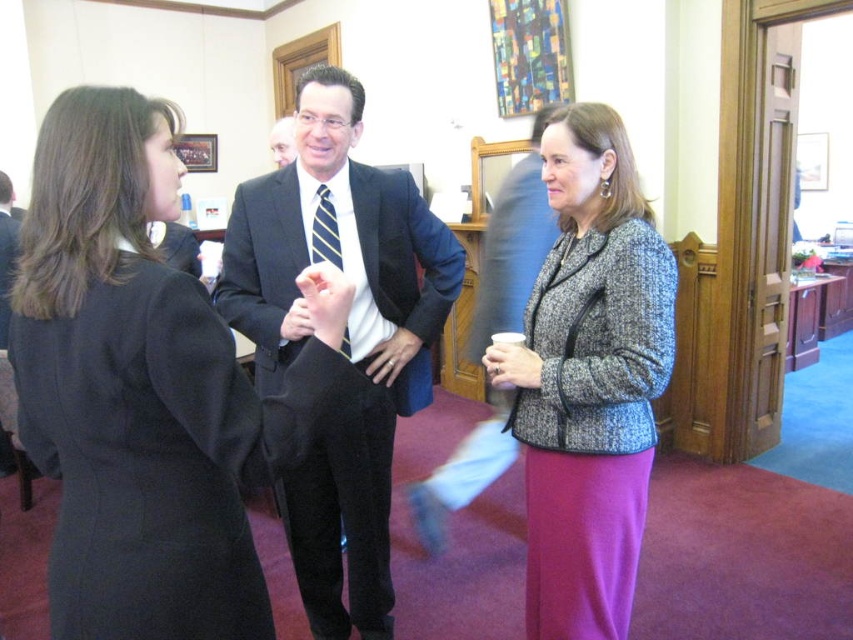
Does black suit at center have a lesser width compared to striped fabric tie at center?

Incorrect, black suit at center's width is not less than striped fabric tie at center's.

Find the location of `black suit at center`. black suit at center is located at coordinates (344, 337).

Between black wool coat at left and black suit at center, which one appears on the left side from the viewer's perspective?

From the viewer's perspective, black wool coat at left appears more on the left side.

The image size is (853, 640). I want to click on black wool coat at left, so click(129, 390).

Find the location of a particular element. The width and height of the screenshot is (853, 640). black wool coat at left is located at coordinates (129, 390).

Is black wool coat at left above striped fabric tie at center?

No.

Is point (68, 330) in front of point (332, 259)?

Yes, it is in front of point (332, 259).

This screenshot has height=640, width=853. In order to click on black wool coat at left in this screenshot , I will do `click(129, 390)`.